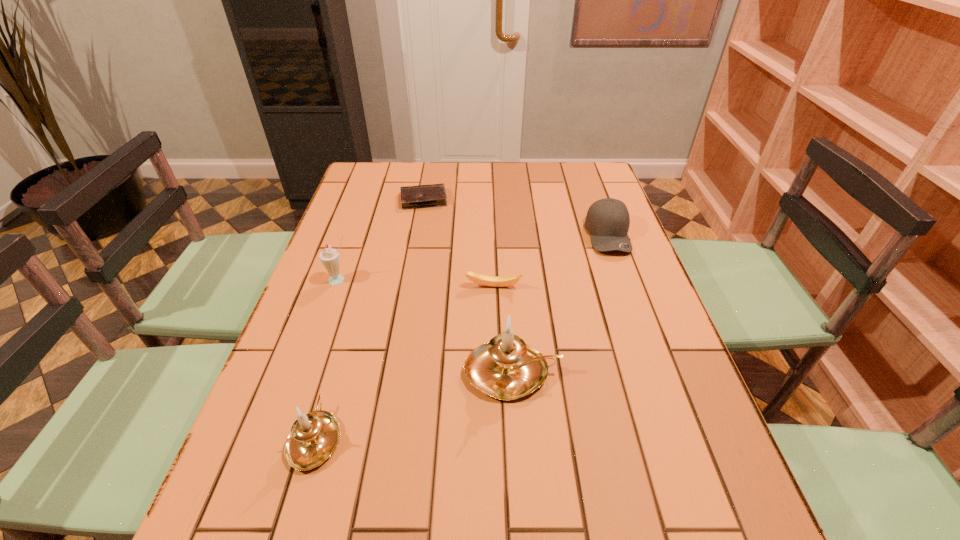
Image resolution: width=960 pixels, height=540 pixels. Find the location of `vacant space located 0.070m on the handle side of the nearer candle holder`. vacant space located 0.070m on the handle side of the nearer candle holder is located at coordinates (333, 377).

Locate an element on the screen. This screenshot has width=960, height=540. vacant area situated on the handle side of the nearer candle holder is located at coordinates (342, 348).

This screenshot has width=960, height=540. I want to click on vacant space located on the handle side of the nearer candle holder, so click(x=356, y=299).

Where is `vacant point located 0.240m on the handle side of the taller candle holder`? The image size is (960, 540). vacant point located 0.240m on the handle side of the taller candle holder is located at coordinates (671, 373).

This screenshot has height=540, width=960. In order to click on vacant space situated on the right of the diary in this screenshot , I will do `click(547, 200)`.

In order to click on vacant space situated on the front brim of the fifth nearest object in this screenshot , I will do `click(656, 363)`.

I want to click on vacant space located 0.090m on the straw side of the milkshake, so click(328, 311).

This screenshot has width=960, height=540. What are the coordinates of `vacant area situated at the stem of the second shortest object` in the screenshot? It's located at (498, 434).

Where is `object that is at the far edge`? object that is at the far edge is located at coordinates [434, 195].

Locate an element on the screen. object located at the near edge is located at coordinates (313, 438).